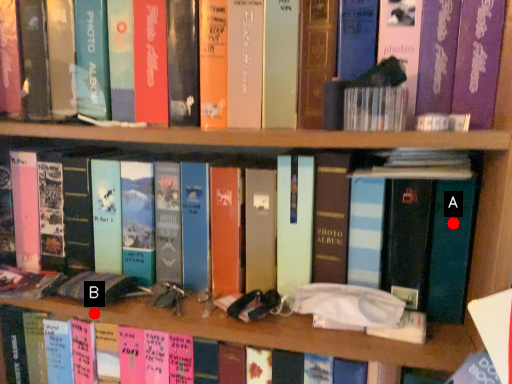
Question: Two points are circled on the image, labeled by A and B beside each circle. Which point is farther to the camera?

Choices:
 (A) A is further
 (B) B is further

Answer: (B)